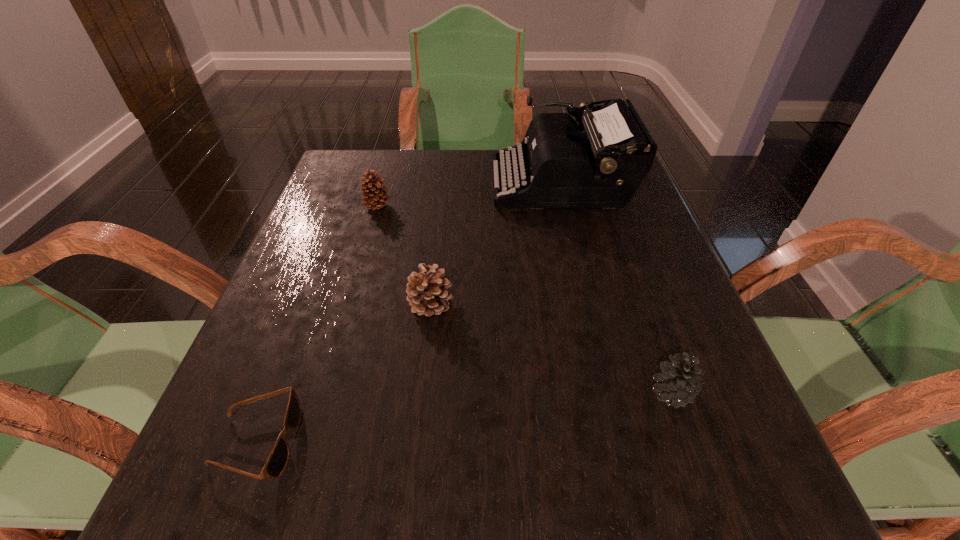
You are a GUI agent. You are given a task and a screenshot of the screen. Output one action in this format:
    pyautogui.click(x=<x>, y=<y>)
    Task: Click on the object located in the far left corner section of the desktop
    
    Given the screenshot: What is the action you would take?
    pyautogui.click(x=374, y=199)

I want to click on object situated at the near left corner, so pos(278,458).

The width and height of the screenshot is (960, 540). Find the location of `object located in the far right corner section of the desktop`. object located in the far right corner section of the desktop is located at coordinates (564, 167).

The image size is (960, 540). In the image, there is a desktop. In order to click on vacant space at the far edge in this screenshot , I will do `click(451, 171)`.

The height and width of the screenshot is (540, 960). What are the coordinates of `vacant space at the left edge of the desktop` in the screenshot? It's located at (355, 277).

In the image, there is a desktop. Find the location of `vacant space at the right edge`. vacant space at the right edge is located at coordinates (705, 450).

You are a GUI agent. You are given a task and a screenshot of the screen. Output one action in this format:
    pyautogui.click(x=<x>, y=<y>)
    Task: Click on the vacant space at the near right corner of the desktop
    The width and height of the screenshot is (960, 540).
    Given the screenshot: What is the action you would take?
    pyautogui.click(x=725, y=499)

This screenshot has width=960, height=540. What are the coordinates of `unoccupied area between the second farthest pinecone and the sunglasses` in the screenshot? It's located at (344, 373).

The height and width of the screenshot is (540, 960). Identify the location of vacant region between the third object from left to right and the shortest object. (344, 373).

What are the coordinates of `blank region between the rightmost pinecone and the typewriter` in the screenshot? It's located at (615, 288).